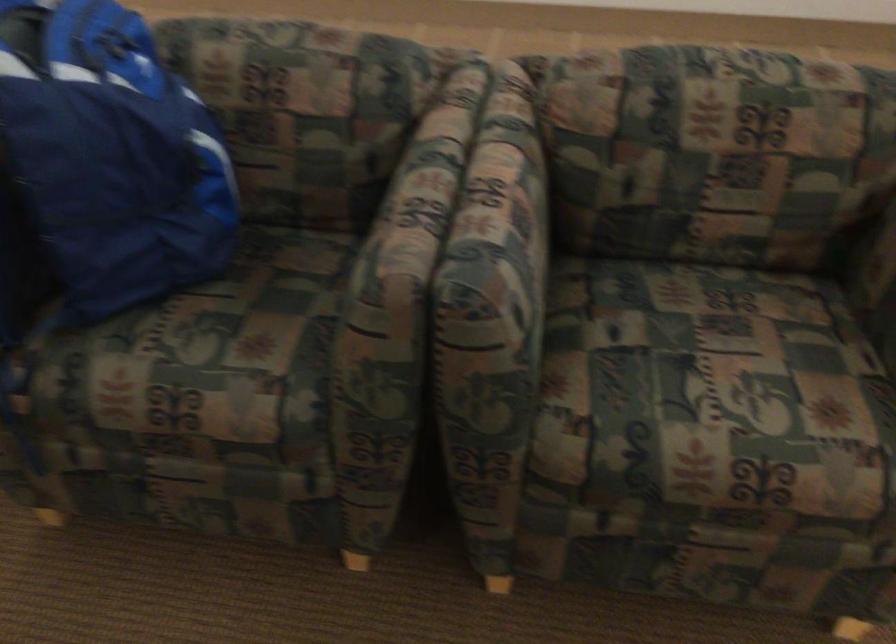
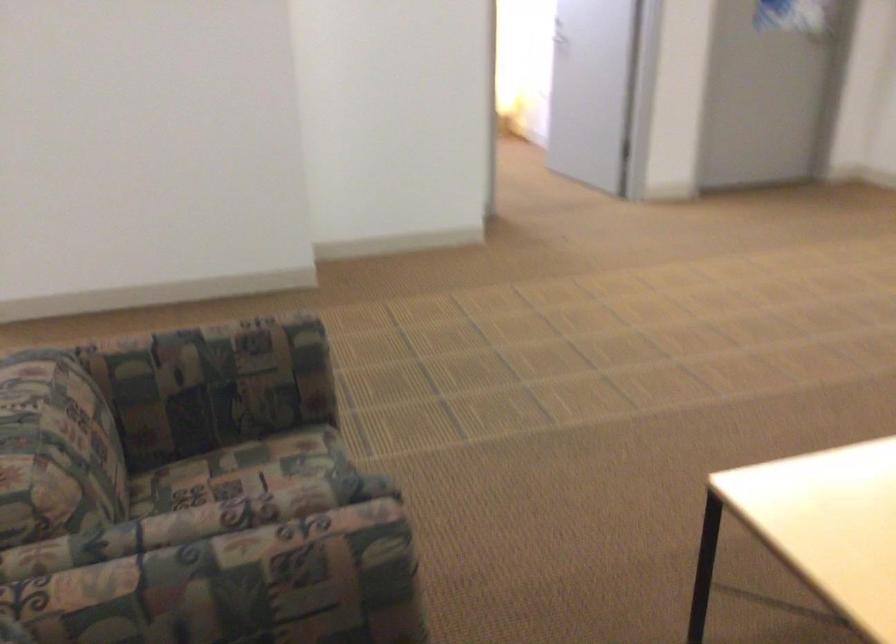
Find the pixel in the second image that matches [771,348] in the first image.

(254, 468)